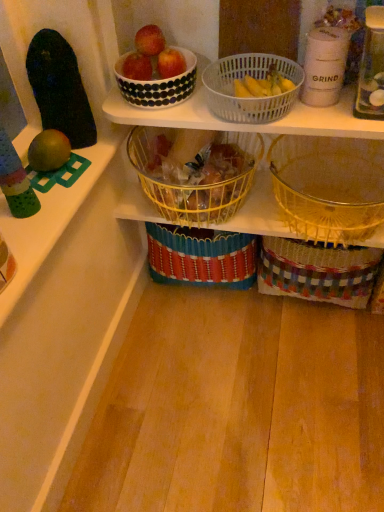
Image resolution: width=384 pixels, height=512 pixels. What are the coordinates of `empty space that is ontop of white dotted bowl at upper center (from a real-world perspective)` in the screenshot? It's located at (149, 58).